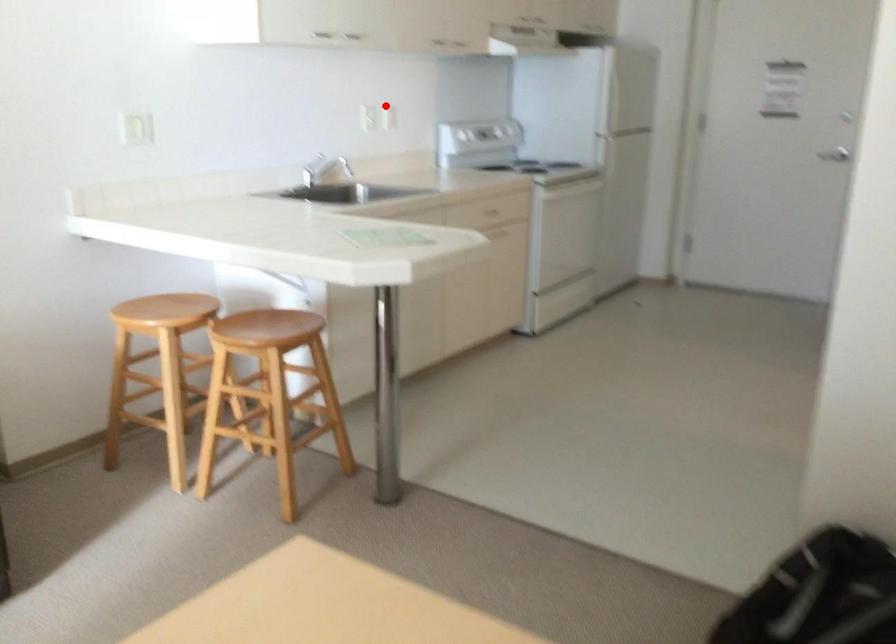
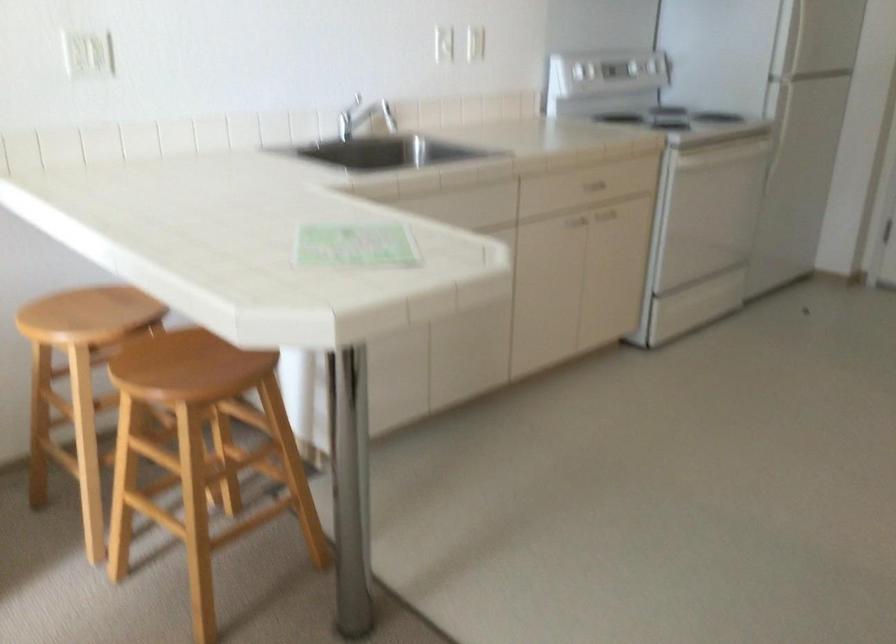
In the second image, find the point that corresponds to the highlighted location in the first image.

(471, 43)